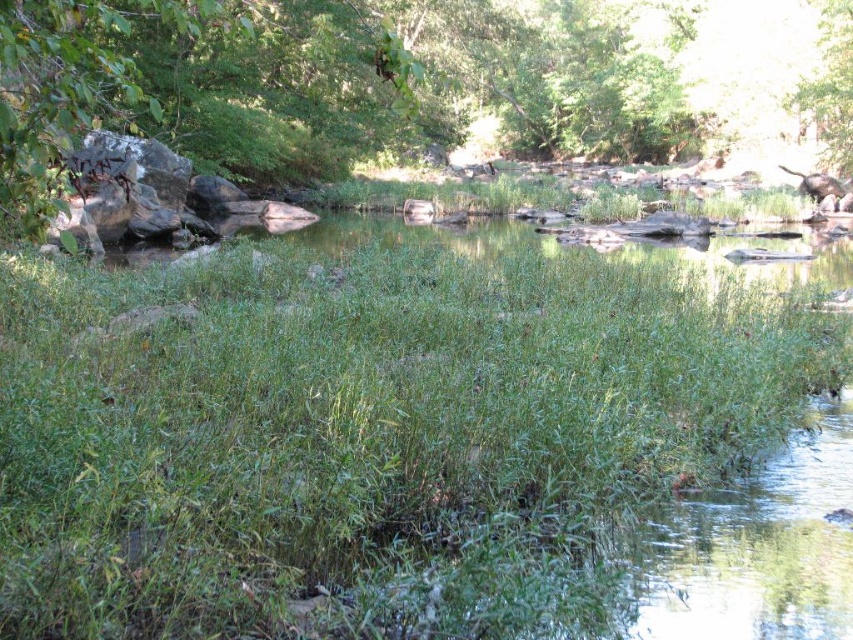
Which is in front, point (318, 465) or point (280, 144)?

Positioned in front is point (318, 465).

Between point (161, 554) and point (401, 56), which one is positioned in front?

Point (161, 554) is in front.

At what (x,y) coordinates should I click in order to perform the action: click on green leafy grass at center. Please return your answer as a coordinate pair (x, y). Looking at the image, I should click on (369, 433).

Is point (407, 3) positioned in front of point (808, 84)?

No, it is not.

Is green leafy tree at upper left to the left of green leafy tree at upper right from the viewer's perspective?

Yes, green leafy tree at upper left is to the left of green leafy tree at upper right.

Is point (651, 132) farther from viewer compared to point (804, 83)?

Yes, it is behind point (804, 83).

You are a GUI agent. You are given a task and a screenshot of the screen. Output one action in this format:
    pyautogui.click(x=<x>, y=<y>)
    Task: Click on the green leafy tree at upper left
    
    Given the screenshot: What is the action you would take?
    pyautogui.click(x=328, y=81)

Where is `green leafy grass at center`? green leafy grass at center is located at coordinates (369, 433).

Does green leafy grass at center have a greater width compared to green leafy tree at upper right?

Indeed, green leafy grass at center has a greater width compared to green leafy tree at upper right.

Between point (560, 328) and point (820, 24), which one is positioned behind?

Point (820, 24)

You are a GUI agent. You are given a task and a screenshot of the screen. Output one action in this format:
    pyautogui.click(x=<x>, y=<y>)
    Task: Click on the green leafy grass at center
    The height and width of the screenshot is (640, 853).
    Given the screenshot: What is the action you would take?
    pyautogui.click(x=369, y=433)